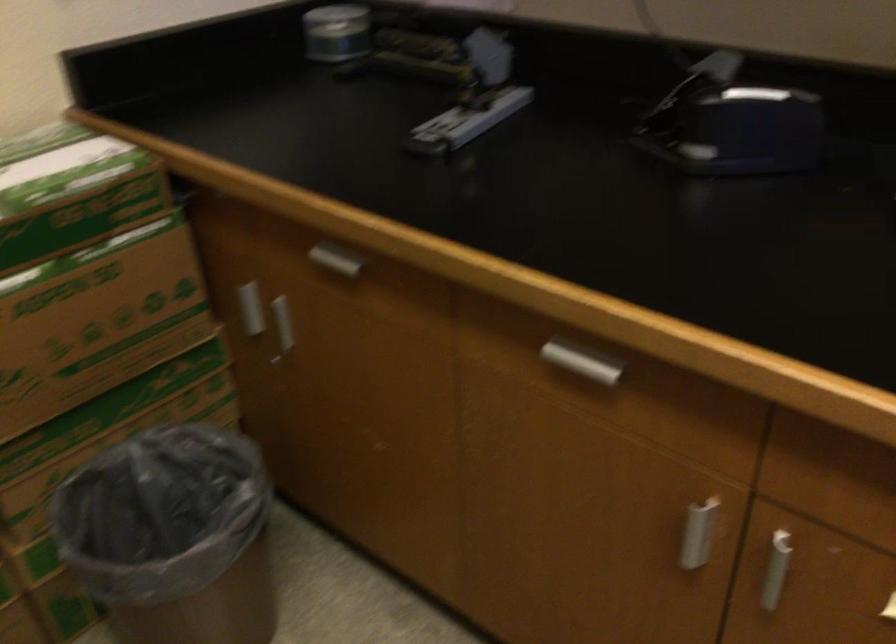
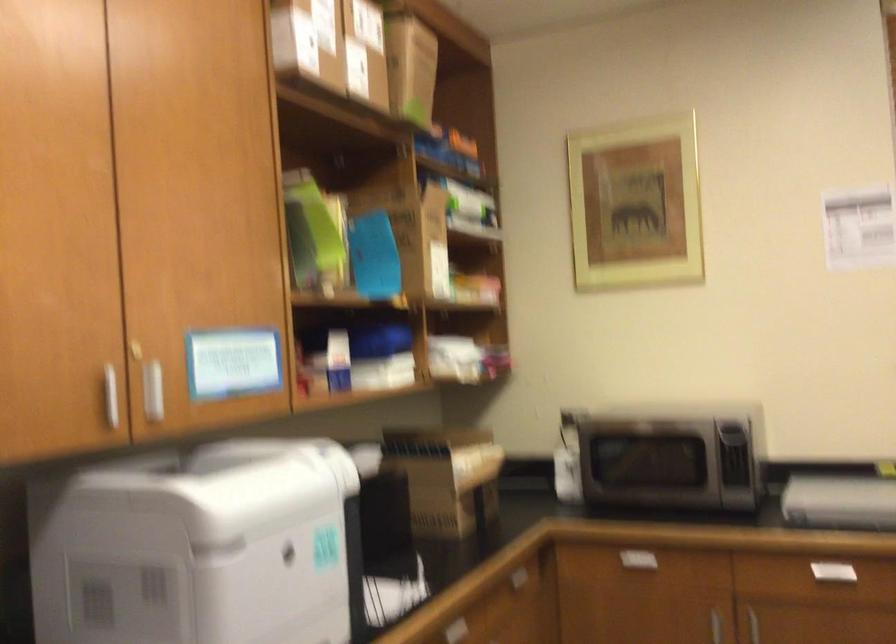
Question: Based on the continuous images, in which direction is the camera rotating? Reply with the corresponding letter.

Choices:
 (A) Left
 (B) Right
 (C) Up
 (D) Down

Answer: (B)